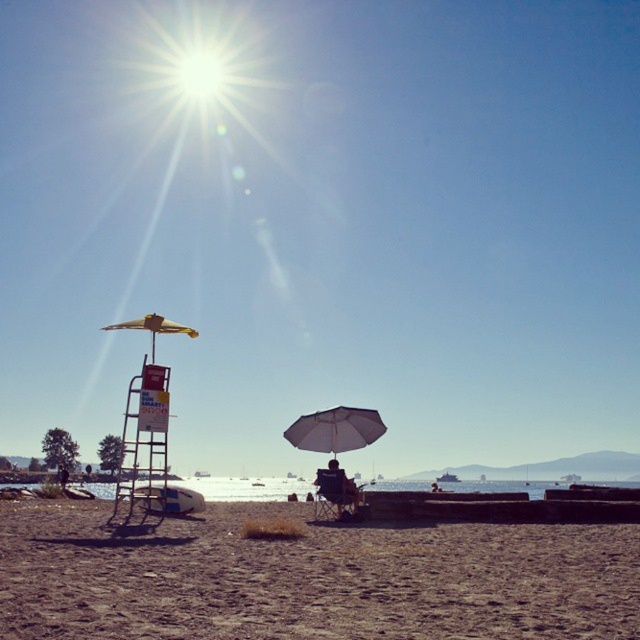
Is bright yellow umbrella at upper center to the right of white matte umbrella at center from the viewer's perspective?

No, bright yellow umbrella at upper center is not to the right of white matte umbrella at center.

Between bright yellow umbrella at upper center and white matte umbrella at center, which one appears on the right side from the viewer's perspective?

white matte umbrella at center

Between point (179, 356) and point (332, 442), which one is positioned in front?

Point (332, 442) is more forward.

This screenshot has width=640, height=640. Find the location of `bright yellow umbrella at upper center`. bright yellow umbrella at upper center is located at coordinates (323, 224).

Does bright yellow umbrella at upper center have a greater width compared to brown sandy beach at lower center?

Yes, bright yellow umbrella at upper center is wider than brown sandy beach at lower center.

Can you confirm if bright yellow umbrella at upper center is taller than brown sandy beach at lower center?

Yes.

The height and width of the screenshot is (640, 640). Identify the location of bright yellow umbrella at upper center. (323, 224).

Who is positioned more to the right, brown sandy beach at lower center or dark blue fabric chair at center?

Positioned to the right is dark blue fabric chair at center.

Between brown sandy beach at lower center and dark blue fabric chair at center, which one has less height?

dark blue fabric chair at center is shorter.

Image resolution: width=640 pixels, height=640 pixels. Describe the element at coordinates (310, 579) in the screenshot. I see `brown sandy beach at lower center` at that location.

You are a GUI agent. You are given a task and a screenshot of the screen. Output one action in this format:
    pyautogui.click(x=<x>, y=<y>)
    Task: Click on the brown sandy beach at lower center
    Image resolution: width=640 pixels, height=640 pixels.
    Given the screenshot: What is the action you would take?
    pyautogui.click(x=310, y=579)